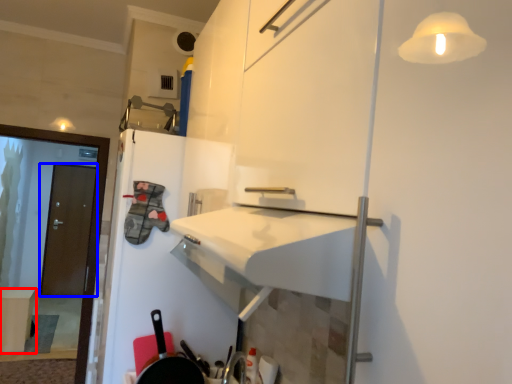
Question: Which object is further to the camera taking this photo, table (highlighted by a red box) or door (highlighted by a blue box)?

Choices:
 (A) table
 (B) door

Answer: (B)